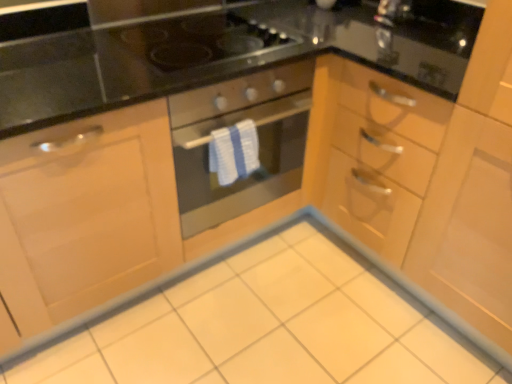
Question: Considering the relative positions of matte black oven at center and white glossy ceramic tile at center in the image provided, is matte black oven at center to the left of white glossy ceramic tile at center from the viewer's perspective?

Choices:
 (A) yes
 (B) no

Answer: (A)

Question: Considering the relative positions of matte black oven at center and white glossy ceramic tile at center in the image provided, is matte black oven at center to the right of white glossy ceramic tile at center from the viewer's perspective?

Choices:
 (A) no
 (B) yes

Answer: (A)

Question: From the image's perspective, is matte black oven at center located beneath white glossy ceramic tile at center?

Choices:
 (A) no
 (B) yes

Answer: (A)

Question: Considering the relative positions of matte black oven at center and white glossy ceramic tile at center in the image provided, is matte black oven at center in front of white glossy ceramic tile at center?

Choices:
 (A) no
 (B) yes

Answer: (A)

Question: Is matte black oven at center taller than white glossy ceramic tile at center?

Choices:
 (A) yes
 (B) no

Answer: (A)

Question: Considering the positions of matte black oven at center and white glossy ceramic tile at center in the image, is matte black oven at center wider or thinner than white glossy ceramic tile at center?

Choices:
 (A) thin
 (B) wide

Answer: (A)

Question: In terms of size, does matte black oven at center appear bigger or smaller than white glossy ceramic tile at center?

Choices:
 (A) small
 (B) big

Answer: (B)

Question: Does point (308, 69) appear closer or farther from the camera than point (350, 362)?

Choices:
 (A) farther
 (B) closer

Answer: (A)

Question: From a real-world perspective, is matte black oven at center physically located above or below white glossy ceramic tile at center?

Choices:
 (A) above
 (B) below

Answer: (A)

Question: In terms of size, does matte black oven at center appear bigger or smaller than black glass gas stove at upper center?

Choices:
 (A) small
 (B) big

Answer: (B)

Question: Considering the positions of point (259, 72) and point (224, 18), is point (259, 72) closer or farther from the camera than point (224, 18)?

Choices:
 (A) farther
 (B) closer

Answer: (B)

Question: Looking at their shapes, would you say matte black oven at center is wider or thinner than black glass gas stove at upper center?

Choices:
 (A) wide
 (B) thin

Answer: (A)

Question: From a real-world perspective, relative to black glass gas stove at upper center, is matte black oven at center vertically above or below?

Choices:
 (A) above
 (B) below

Answer: (B)

Question: In terms of height, does black glass gas stove at upper center look taller or shorter compared to matte black oven at center?

Choices:
 (A) short
 (B) tall

Answer: (A)

Question: Is black glass gas stove at upper center in front of or behind matte black oven at center in the image?

Choices:
 (A) behind
 (B) front

Answer: (A)